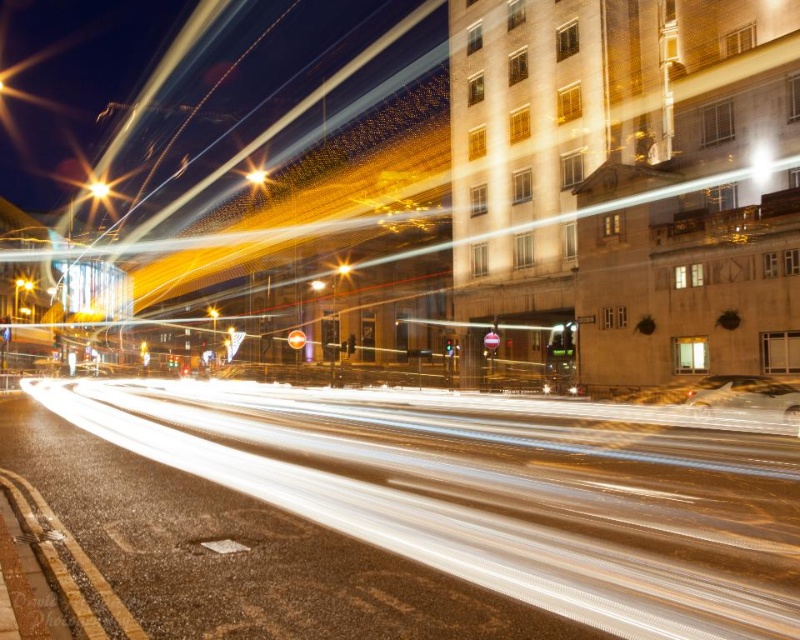
Question: Does white light trails at center appear over metallic silver car at center?

Choices:
 (A) yes
 (B) no

Answer: (B)

Question: Estimate the real-world distances between objects in this image. Which object is closer to the bright yellow light at upper center?

Choices:
 (A) metallic silver car at center
 (B) bright yellow light at upper left
 (C) white light trails at center

Answer: (B)

Question: Is bright yellow light at upper left to the left of bright yellow streetlight at center from the viewer's perspective?

Choices:
 (A) yes
 (B) no

Answer: (A)

Question: Estimate the real-world distances between objects in this image. Which object is farther from the bright yellow light at upper left?

Choices:
 (A) white light trails at center
 (B) bright yellow streetlight at center
 (C) bright yellow light at upper center

Answer: (A)

Question: Is white light trails at center positioned behind metallic silver car at center?

Choices:
 (A) yes
 (B) no

Answer: (B)

Question: Considering the real-world distances, which object is farthest from the bright yellow streetlight at center?

Choices:
 (A) bright yellow light at upper center
 (B) white light trails at center
 (C) bright yellow light at upper left

Answer: (C)